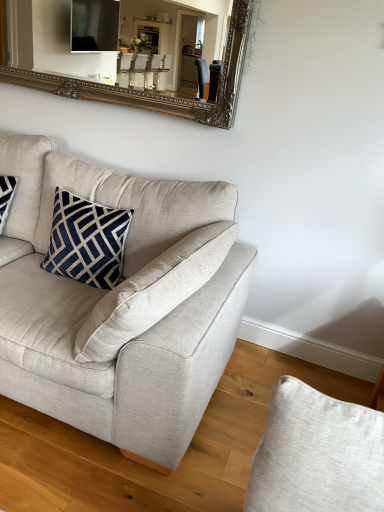
Question: Is light beige fabric couch at center to the left or to the right of silver/gilded mirror at upper center in the image?

Choices:
 (A) left
 (B) right

Answer: (A)

Question: From a real-world perspective, is light beige fabric couch at center physically located above or below silver/gilded mirror at upper center?

Choices:
 (A) above
 (B) below

Answer: (B)

Question: Based on their relative distances, which object is nearer to the light beige fabric couch at center?

Choices:
 (A) navy blue fabric pillow at upper left
 (B) silver/gilded mirror at upper center

Answer: (A)

Question: Estimate the real-world distances between objects in this image. Which object is farther from the silver/gilded mirror at upper center?

Choices:
 (A) light beige fabric couch at center
 (B) navy blue fabric pillow at upper left

Answer: (A)